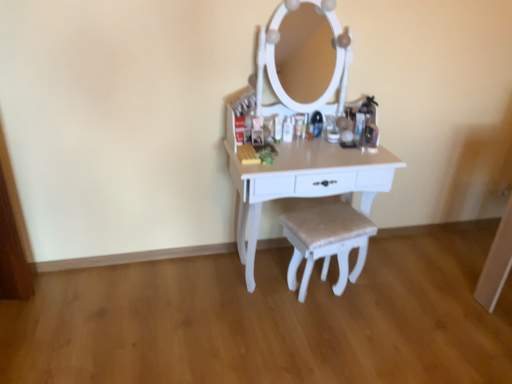
You are a GUI agent. You are given a task and a screenshot of the screen. Output one action in this format:
    pyautogui.click(x=<x>, y=<y>)
    Task: Click on the free region under beige fabric stool at center (from a real-world perspective)
    This screenshot has width=512, height=384.
    Given the screenshot: What is the action you would take?
    pyautogui.click(x=325, y=303)